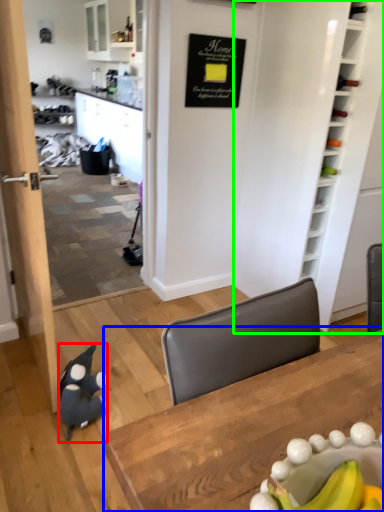
Question: Which object is positioned closest to penguin (highlighted by a red box)? Select from table (highlighted by a blue box) and bookshelf (highlighted by a green box).

Choices:
 (A) table
 (B) bookshelf

Answer: (A)